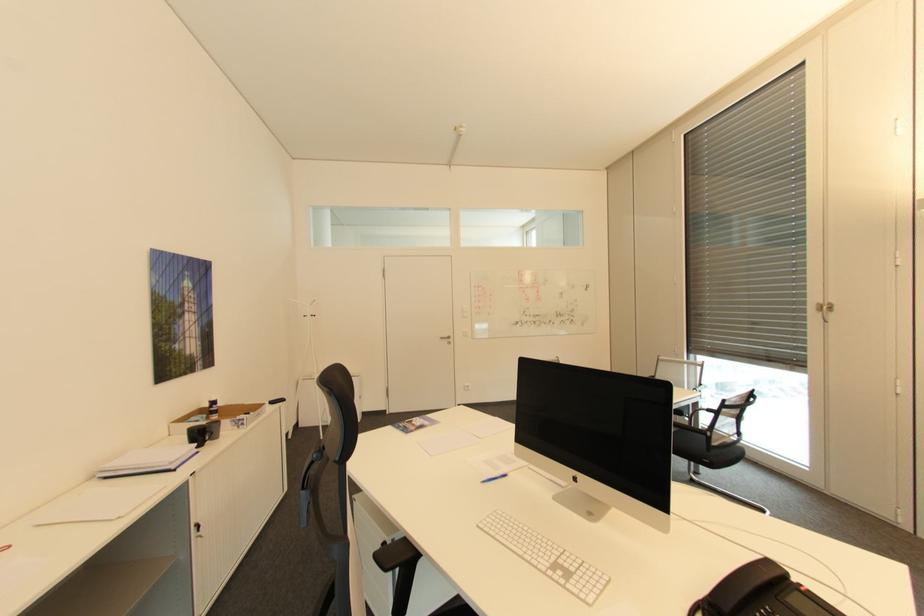
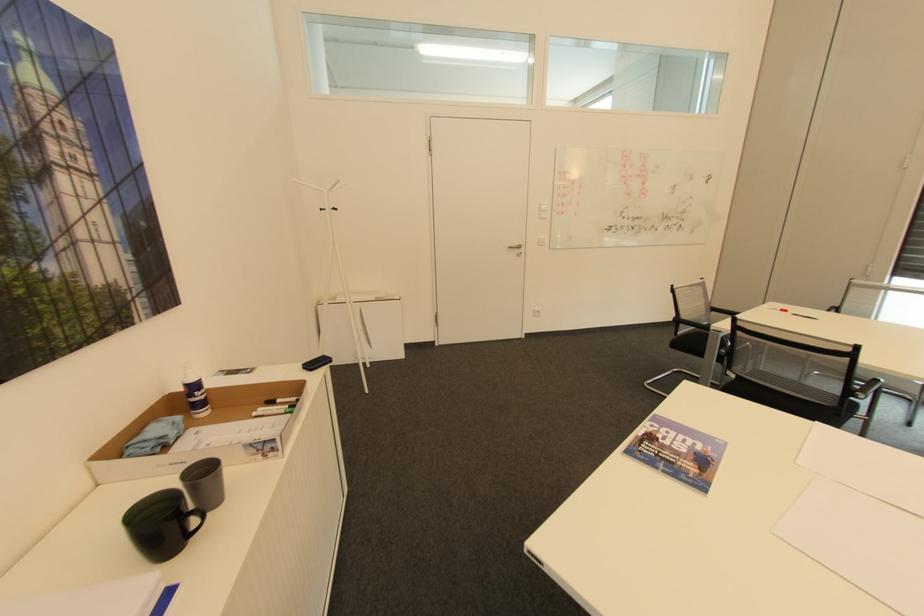
Find the pixel in the second image that matches (x=224, y=424) in the first image.

(222, 477)